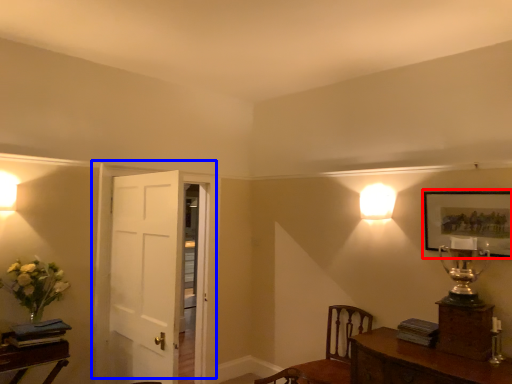
Question: Which of the following is the closest to the observer, picture frame (highlighted by a red box) or door (highlighted by a blue box)?

Choices:
 (A) picture frame
 (B) door

Answer: (A)